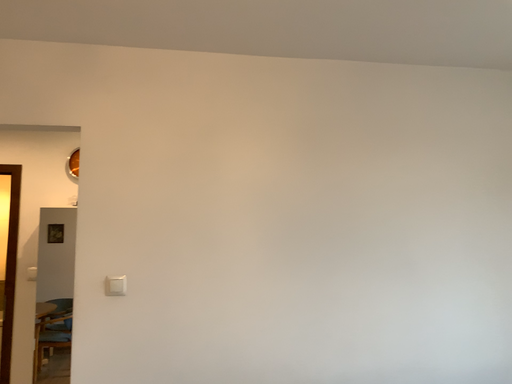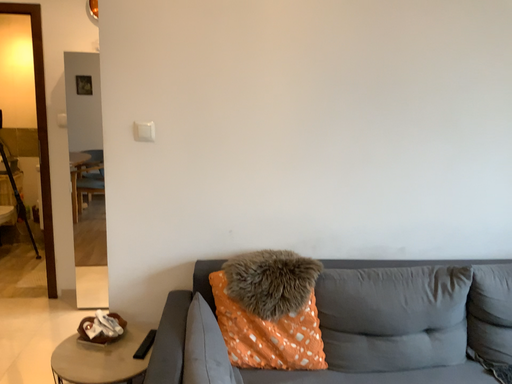
Question: How did the camera likely rotate when shooting the video?

Choices:
 (A) rotated upward
 (B) rotated downward

Answer: (B)